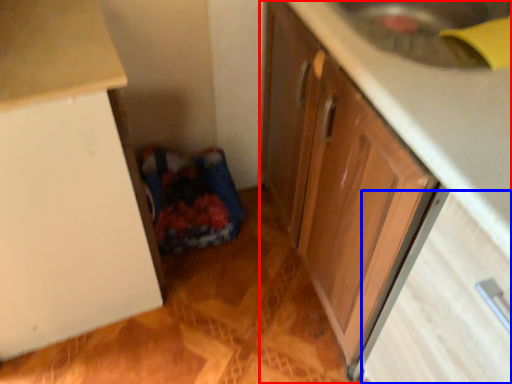
Question: Which of the following is the farthest to the observer, cabinetry (highlighted by a red box) or drawer (highlighted by a blue box)?

Choices:
 (A) cabinetry
 (B) drawer

Answer: (B)